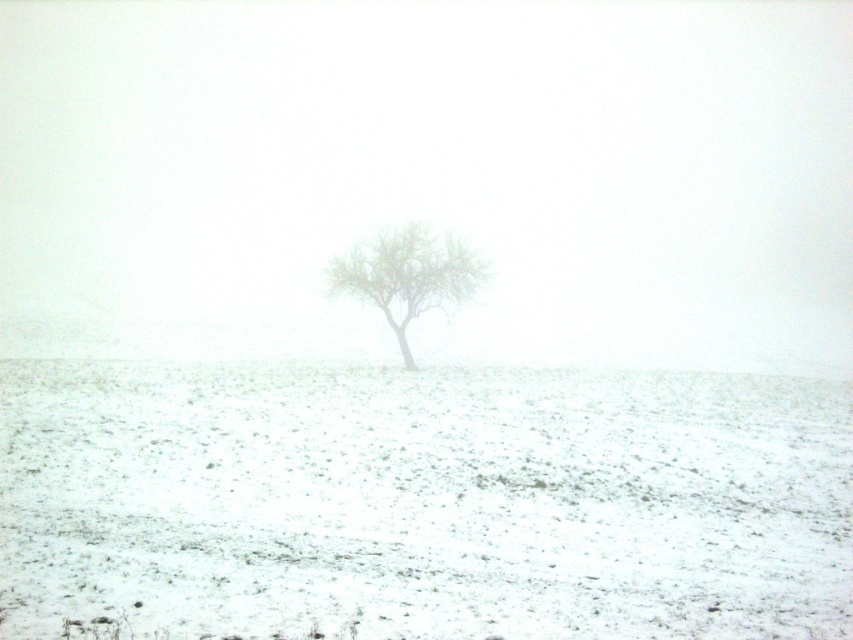
Between white snow at center and green leafy tree at center, which one has less height?

Standing shorter between the two is green leafy tree at center.

Between point (51, 484) and point (366, 288), which one is positioned behind?

The point (366, 288) is more distant.

Is point (462, 472) more distant than point (364, 292)?

No, (462, 472) is closer to viewer.

Where is `white snow at center`? This screenshot has height=640, width=853. white snow at center is located at coordinates (422, 500).